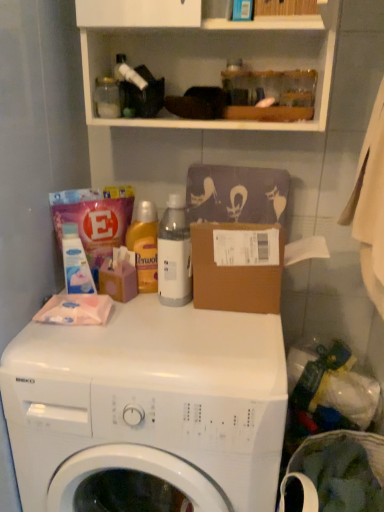
Question: Is white matte detergent at left in front of clear plastic laundry basket at lower right?

Choices:
 (A) yes
 (B) no

Answer: (B)

Question: Is white matte detergent at left further to camera compared to clear plastic laundry basket at lower right?

Choices:
 (A) yes
 (B) no

Answer: (A)

Question: From a real-world perspective, is white matte detergent at left over clear plastic laundry basket at lower right?

Choices:
 (A) no
 (B) yes

Answer: (B)

Question: Is white matte detergent at left shorter than clear plastic laundry basket at lower right?

Choices:
 (A) no
 (B) yes

Answer: (B)

Question: Can you confirm if white matte detergent at left is bigger than clear plastic laundry basket at lower right?

Choices:
 (A) yes
 (B) no

Answer: (B)

Question: Is point (130, 237) positioned closer to the camera than point (142, 312)?

Choices:
 (A) closer
 (B) farther

Answer: (B)

Question: In the image, is translucent plastic bottle at center on the left side or the right side of white glossy washing machine at center?

Choices:
 (A) right
 (B) left

Answer: (B)

Question: Do you think translucent plastic bottle at center is within white glossy washing machine at center, or outside of it?

Choices:
 (A) outside
 (B) inside

Answer: (A)

Question: From a real-world perspective, relative to white glossy washing machine at center, is translucent plastic bottle at center vertically above or below?

Choices:
 (A) above
 (B) below

Answer: (A)

Question: Based on their sizes in the image, would you say white glossy washing machine at center is bigger or smaller than translucent plastic bottle at center?

Choices:
 (A) small
 (B) big

Answer: (B)

Question: Is white glossy washing machine at center in front of or behind translucent plastic bottle at center in the image?

Choices:
 (A) front
 (B) behind

Answer: (A)

Question: Is white glossy washing machine at center situated inside translucent plastic bottle at center or outside?

Choices:
 (A) inside
 (B) outside

Answer: (B)

Question: Is point (19, 336) closer or farther from the camera than point (152, 262)?

Choices:
 (A) closer
 (B) farther

Answer: (A)

Question: Choose the correct answer: Is translucent plastic bottle at center inside white plastic bottle at center or outside it?

Choices:
 (A) inside
 (B) outside

Answer: (B)

Question: Considering the positions of translucent plastic bottle at center and white plastic bottle at center in the image, is translucent plastic bottle at center wider or thinner than white plastic bottle at center?

Choices:
 (A) thin
 (B) wide

Answer: (A)